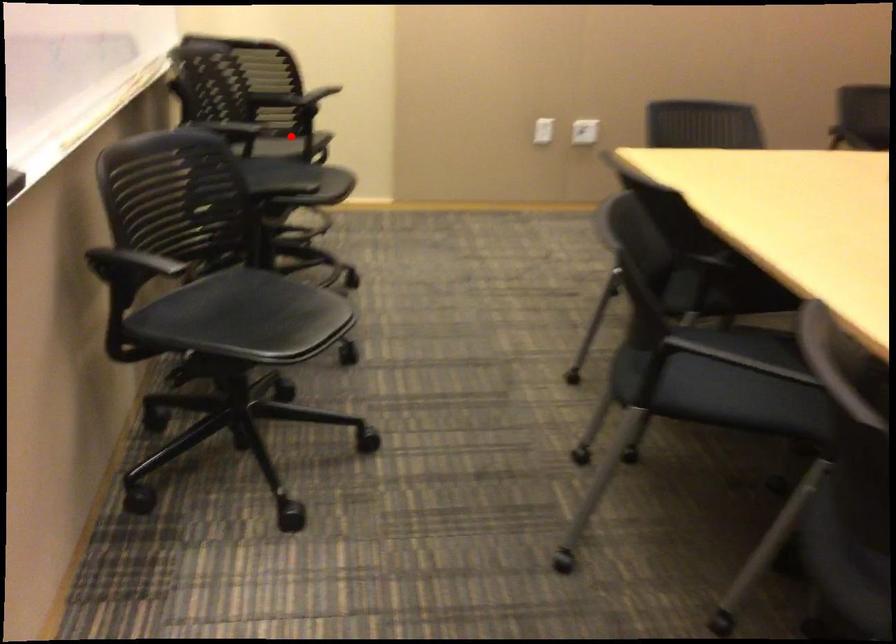
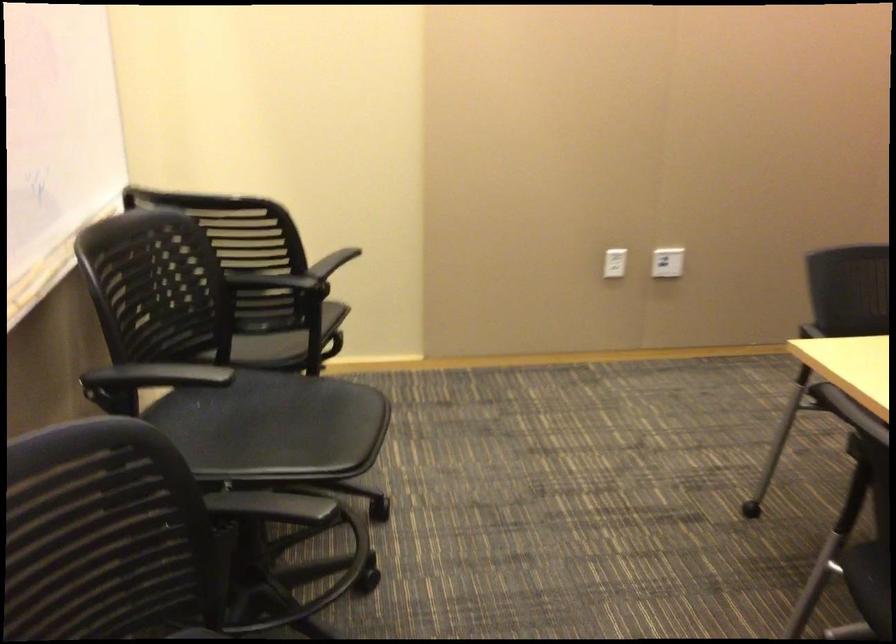
Question: I am providing you with two images of the same scene from different viewpoints. Given a red point in image1, look at the same physical point in image2. Is it:

Choices:
 (A) Closer to the viewpoint
 (B) Farther from the viewpoint

Answer: (A)